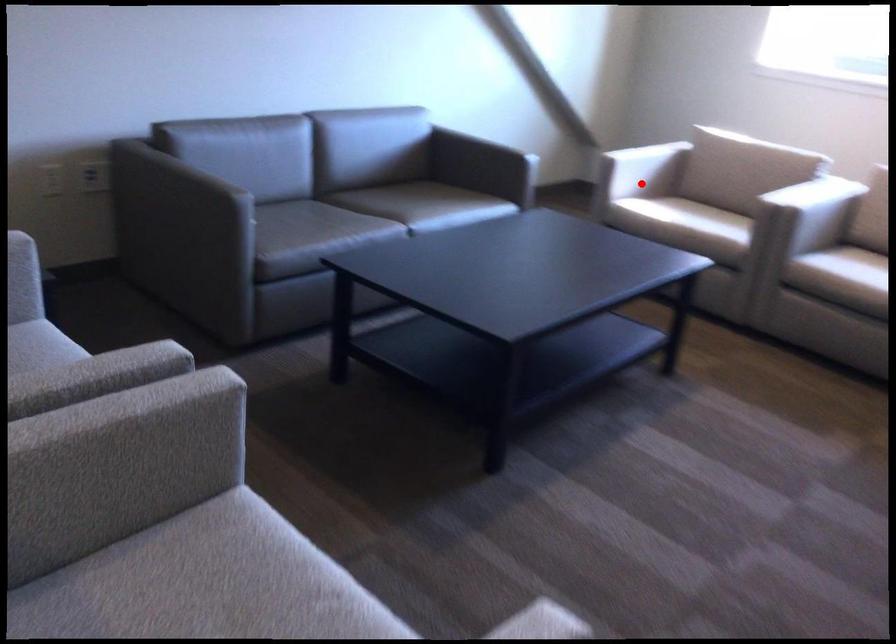
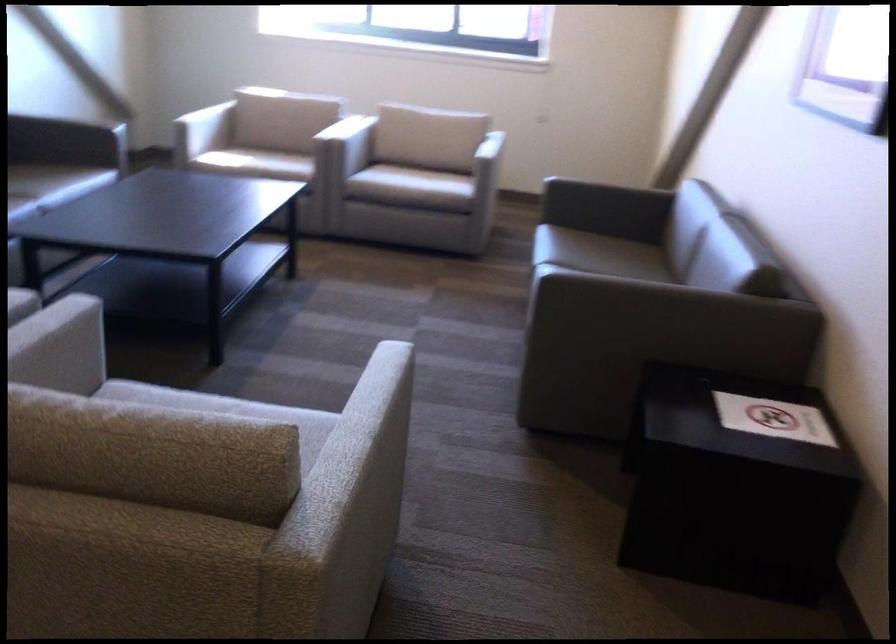
The point at the highlighted location is marked in the first image. Where is the corresponding point in the second image?

(202, 131)